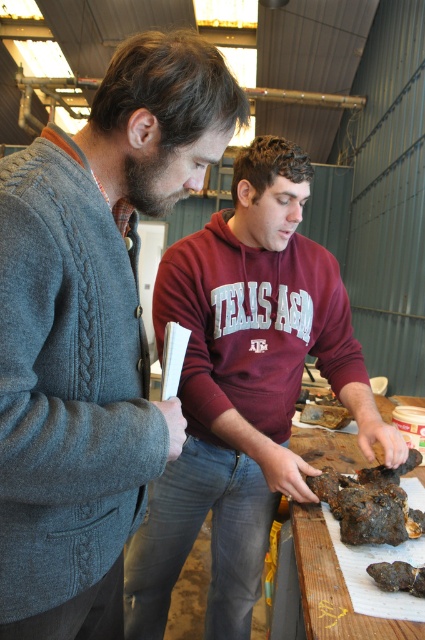
You are an observer standing in the room. You see the gray knitted sweater at left and the maroon hoodie at center. Which one is closer to you?

The gray knitted sweater at left is closer to you because it is in front of the maroon hoodie at center.

You are standing in the industrial workshop shown in the image. You need to place a new tool on the exact location where the maroon hoodie at center is currently positioned. What are the coordinates of that location?

The coordinates of the maroon hoodie at center are at point (243,388).

You are standing in the room and want to hand a tool to the person wearing the gray knitted sweater at left and the maroon hoodie at center. Which person is closer to your current position if you are facing the scene?

The gray knitted sweater at left is closer to you because it is positioned to the left of the maroon hoodie at center, and in a typical left to right arrangement, the left side is closer when facing the scene.